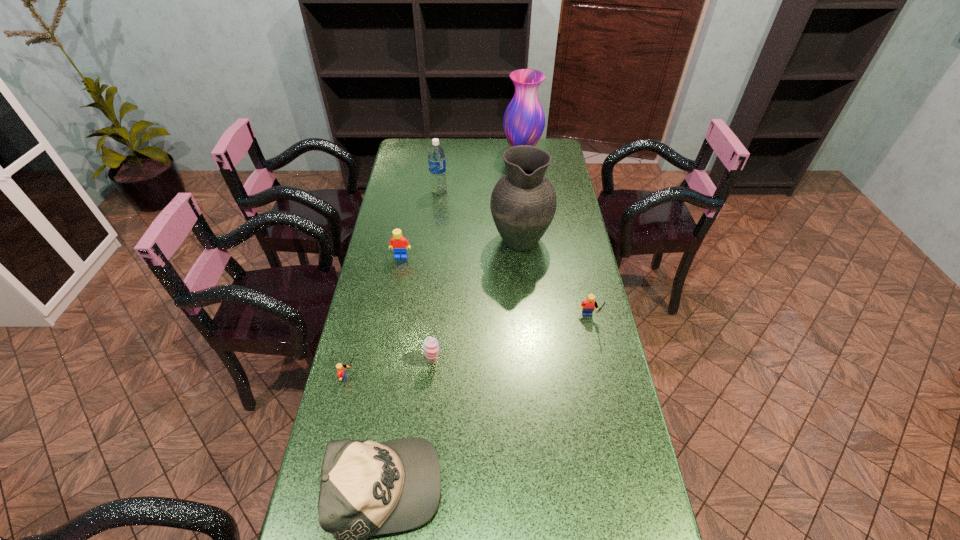
Locate an element on the screen. This screenshot has height=540, width=960. vacant space positioned 0.320m on the front-facing side of the nearest Lego is located at coordinates (478, 378).

At what (x,y) coordinates should I click in order to perform the action: click on object present at the far edge. Please return your answer as a coordinate pair (x, y). The height and width of the screenshot is (540, 960). Looking at the image, I should click on 524,121.

Image resolution: width=960 pixels, height=540 pixels. I want to click on vase located in the right edge section of the desktop, so click(524, 121).

Identify the location of pitcher present at the right edge. The height and width of the screenshot is (540, 960). (523, 203).

This screenshot has width=960, height=540. Identify the location of Lego located in the right edge section of the desktop. (588, 305).

Locate an element on the screen. Image resolution: width=960 pixels, height=540 pixels. object present at the far right corner is located at coordinates (524, 121).

Locate an element on the screen. free space at the far edge of the desktop is located at coordinates (464, 148).

Locate an element on the screen. This screenshot has height=540, width=960. vacant space at the left edge of the desktop is located at coordinates (396, 291).

This screenshot has width=960, height=540. Find the location of `free spot at the right edge of the desktop`. free spot at the right edge of the desktop is located at coordinates (563, 308).

Locate an element on the screen. free location at the far right corner of the desktop is located at coordinates (553, 146).